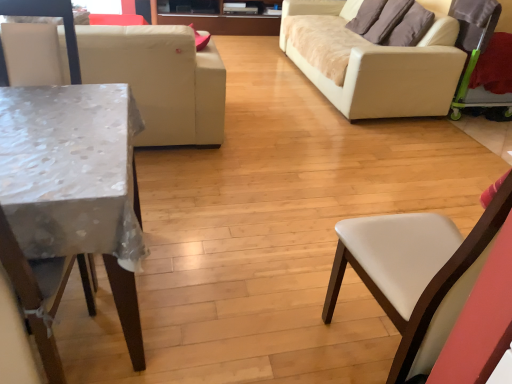
Find the location of `vacant space in front of green plastic swivel chair at right`. vacant space in front of green plastic swivel chair at right is located at coordinates (488, 138).